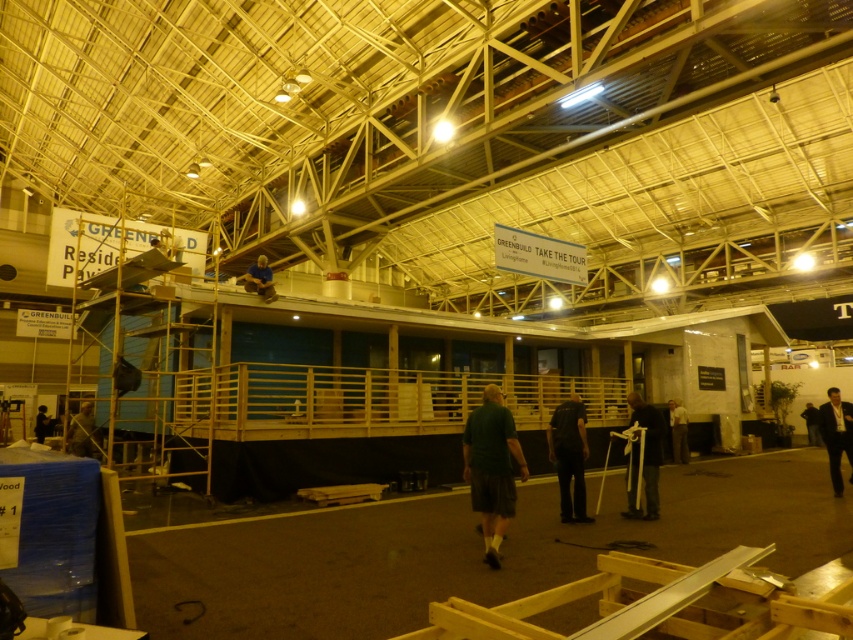
Question: Does green matte shirt at center appear on the right side of dark suit at lower right?

Choices:
 (A) yes
 (B) no

Answer: (B)

Question: Which object appears closest to the camera in this image?

Choices:
 (A) dark suit at lower right
 (B) green matte shirt at center
 (C) green fabric person at lower left
 (D) dark green shirt at center

Answer: (B)

Question: Which point is closer to the camera?

Choices:
 (A) (815, 442)
 (B) (83, 452)
 (C) (637, 406)

Answer: (C)

Question: Which point is closer to the camera?

Choices:
 (A) (90, 432)
 (B) (44, 419)

Answer: (A)

Question: Does dark gray fabric pants at lower right come in front of dark brown leather jacket at lower right?

Choices:
 (A) no
 (B) yes

Answer: (B)

Question: Where is green matte shirt at center located in relation to dark gray fabric pants at lower right in the image?

Choices:
 (A) left
 (B) right

Answer: (A)